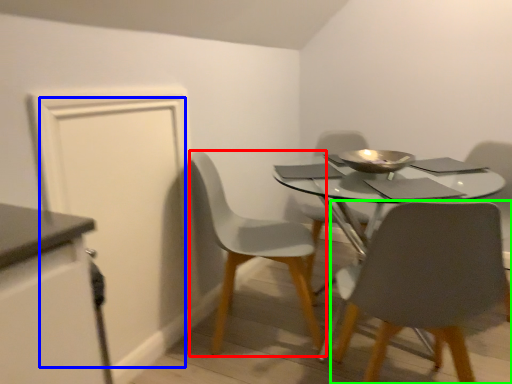
Question: Which is nearer to the chair (highlighted by a red box)? door (highlighted by a blue box) or chair (highlighted by a green box).

Choices:
 (A) door
 (B) chair

Answer: (A)